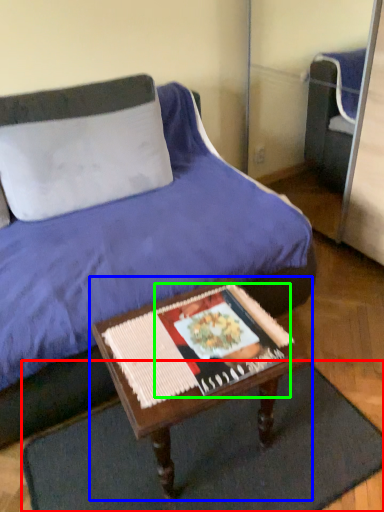
Question: Which object is the closest to the doormat (highlighted by a red box)? Choose among these: table (highlighted by a blue box) or magazine (highlighted by a green box).

Choices:
 (A) table
 (B) magazine

Answer: (A)